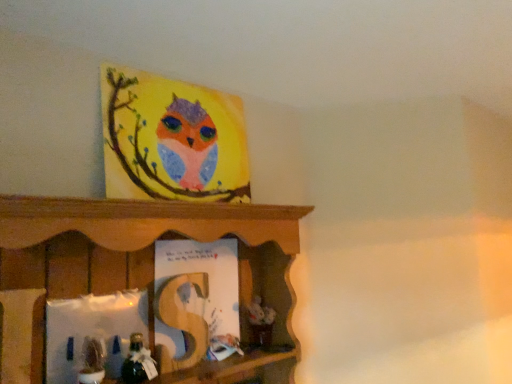
Question: Is matte green plant at lower left, arranged as the 1th toy when viewed from the left, wider or thinner than shiny metallic toy at lower left, which ranks as the second toy in left-to-right order?

Choices:
 (A) thin
 (B) wide

Answer: (A)

Question: Choose the correct answer: Is matte green plant at lower left, acting as the second toy starting from the right, inside shiny metallic toy at lower left, which ranks as the second toy in left-to-right order, or outside it?

Choices:
 (A) inside
 (B) outside

Answer: (B)

Question: Which of these objects is positioned farthest from the matte green plant at lower left, acting as the second toy starting from the right?

Choices:
 (A) shiny metallic toy at lower left, which appears as the first toy when viewed from the right
 (B) matte paper book at center

Answer: (B)

Question: Estimate the real-world distances between objects in this image. Which object is closer to the matte paper book at center?

Choices:
 (A) shiny metallic toy at lower left, which ranks as the second toy in left-to-right order
 (B) matte green plant at lower left, acting as the second toy starting from the right

Answer: (A)